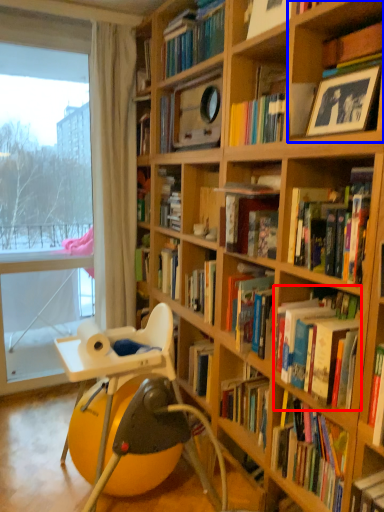
Question: Which of the following is the farthest to the observer, book (highlighted by a red box) or shelf (highlighted by a blue box)?

Choices:
 (A) book
 (B) shelf

Answer: (A)